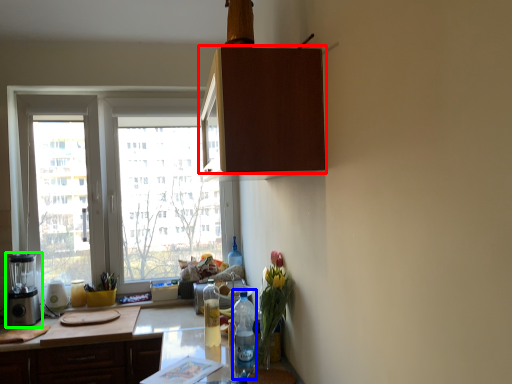
Question: Estimate the real-world distances between objects in this image. Which object is closer to cabinetry (highlighted by a red box), bottle (highlighted by a blue box) or appliance (highlighted by a green box)?

Choices:
 (A) bottle
 (B) appliance

Answer: (A)